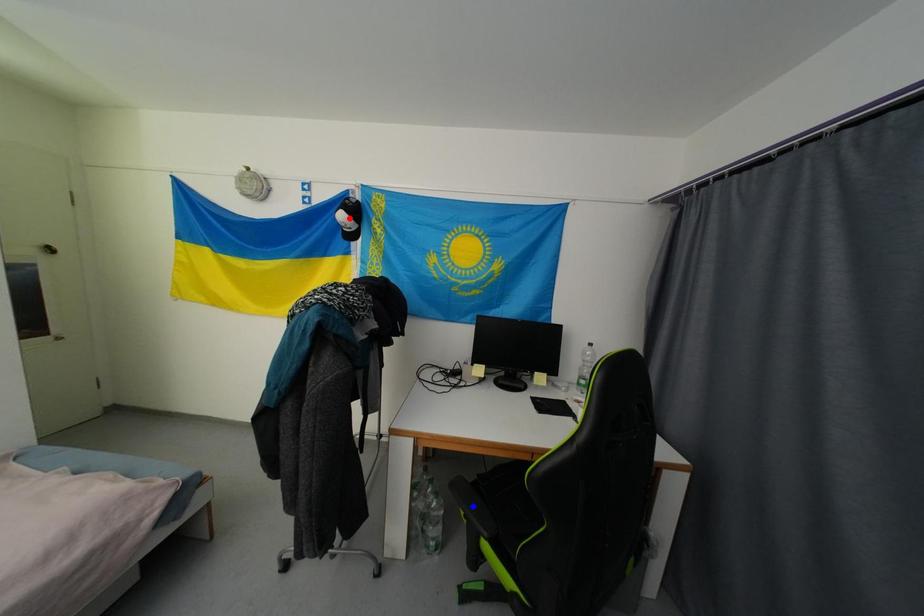
Question: Two points are marked on the image. Which point is closer to the camera?

Choices:
 (A) Blue point is closer.
 (B) Red point is closer.

Answer: (A)